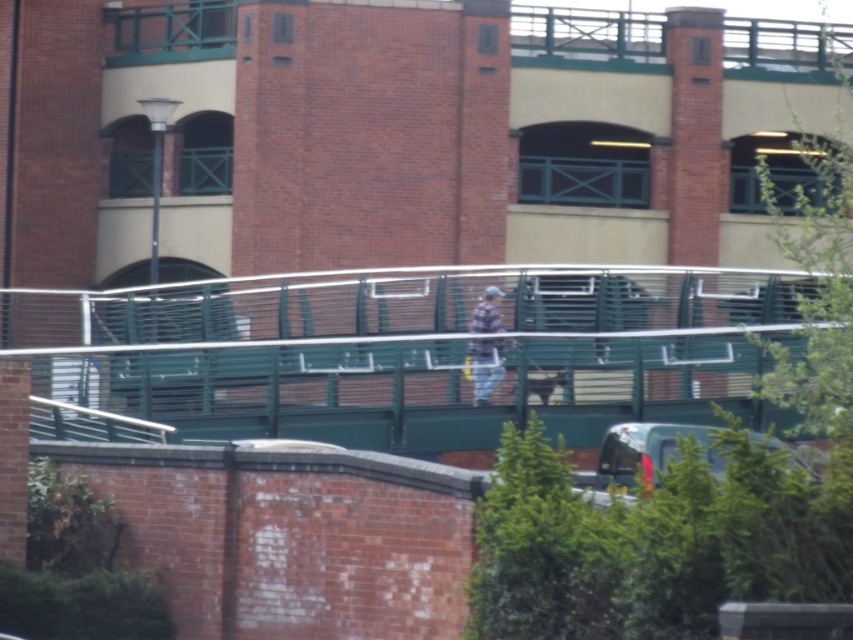
Question: Which point is farther to the camera?

Choices:
 (A) green metal pedestrian bridge at center
 (B) plaid fabric shirt at center

Answer: (B)

Question: Which object is closer to the camera taking this photo?

Choices:
 (A) plaid fabric shirt at center
 (B) green metal pedestrian bridge at center

Answer: (B)

Question: Can you confirm if green metal pedestrian bridge at center is wider than plaid fabric shirt at center?

Choices:
 (A) yes
 (B) no

Answer: (A)

Question: Which point is closer to the camera taking this photo?

Choices:
 (A) (140, 372)
 (B) (474, 401)

Answer: (A)

Question: Can you confirm if green metal pedestrian bridge at center is positioned to the left of plaid fabric shirt at center?

Choices:
 (A) no
 (B) yes

Answer: (B)

Question: In this image, where is green metal pedestrian bridge at center located relative to plaid fabric shirt at center?

Choices:
 (A) right
 (B) left

Answer: (B)